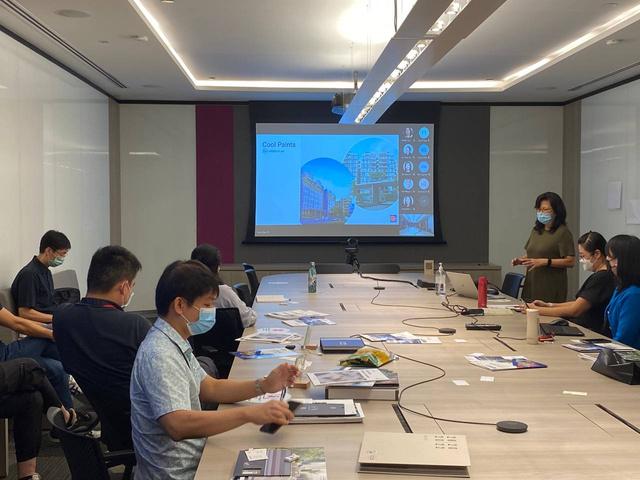
Locate an element on the screen. The width and height of the screenshot is (640, 480). projector is located at coordinates (333, 103).